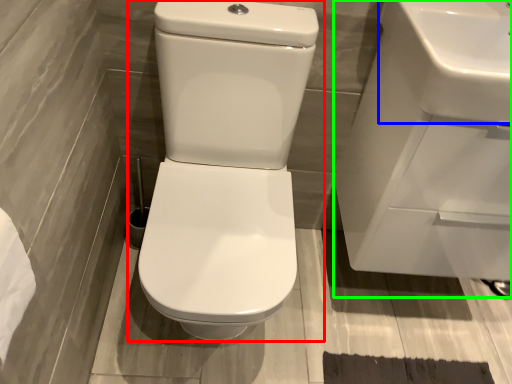
Question: Considering the real-world distances, which object is farthest from toilet (highlighted by a red box)? sink (highlighted by a blue box) or sink (highlighted by a green box)?

Choices:
 (A) sink
 (B) sink

Answer: (A)